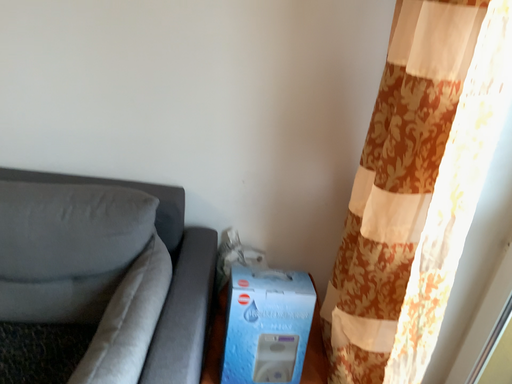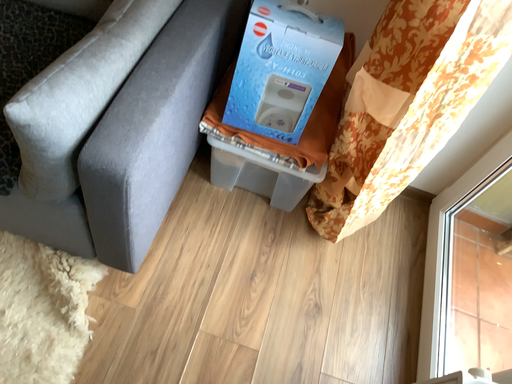
Question: How did the camera likely rotate when shooting the video?

Choices:
 (A) rotated right
 (B) rotated left

Answer: (B)